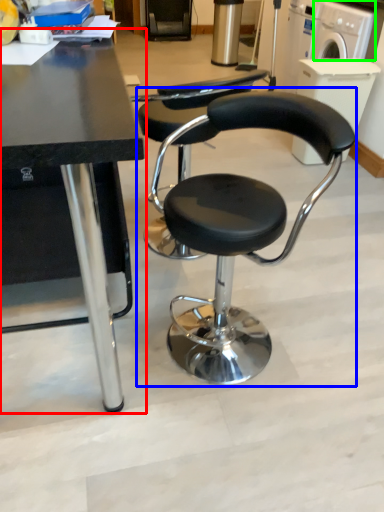
Question: Based on their relative distances, which object is nearer to table (highlighted by a red box)? Choose from chair (highlighted by a blue box) and washing machine (highlighted by a green box).

Choices:
 (A) chair
 (B) washing machine

Answer: (A)